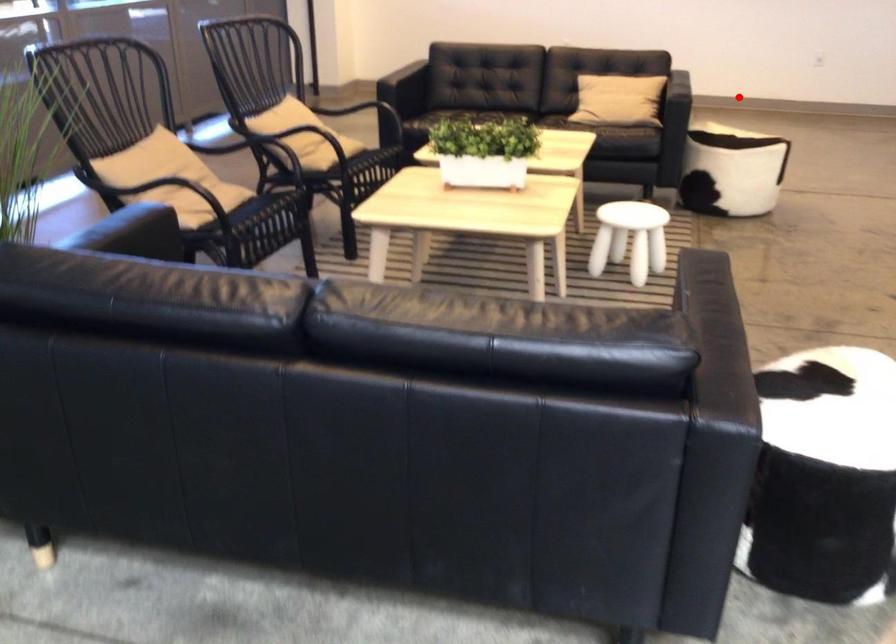
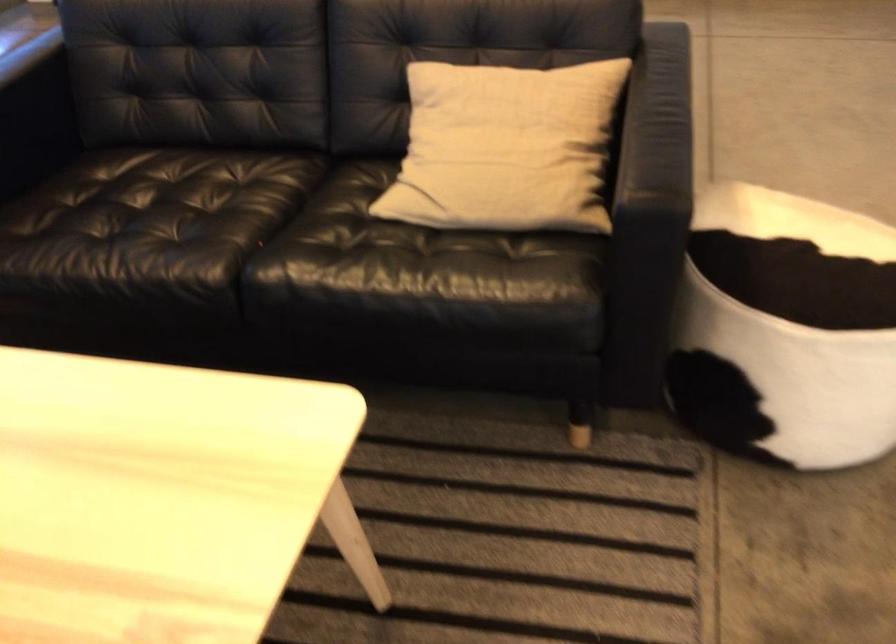
Question: I am providing you with two images of the same scene from different viewpoints. A red point is shown in image1. For the corresponding object point in image2, is it positioned nearer or farther from the camera?

Choices:
 (A) Nearer
 (B) Farther

Answer: (A)